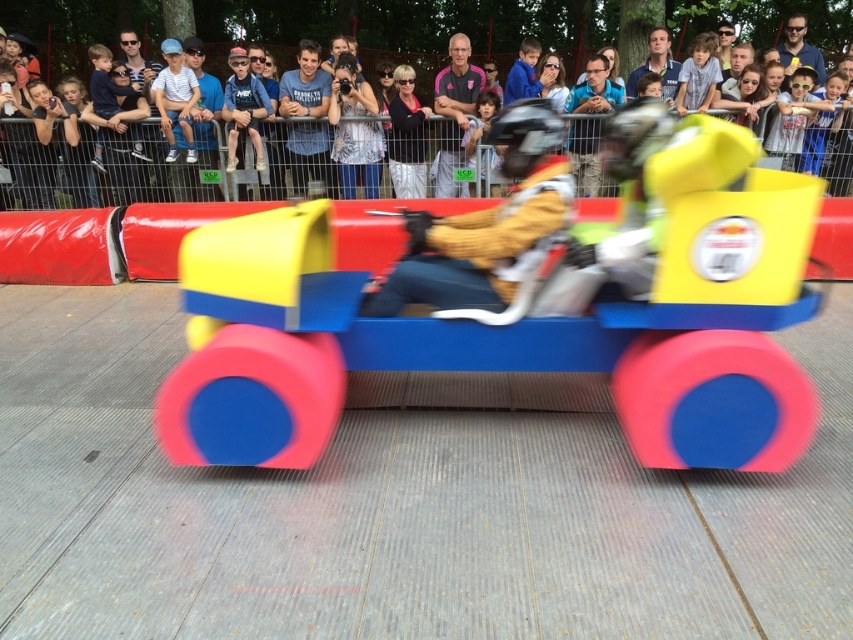
Question: Is matte plastic toy car at center closer to the viewer compared to denim jacket at upper center?

Choices:
 (A) yes
 (B) no

Answer: (A)

Question: Which object is farther from the camera taking this photo?

Choices:
 (A) matte plastic crowd at upper center
 (B) denim jacket at upper center
 (C) matte plastic toy car at center
 (D) yellow matte helmet at center

Answer: (A)

Question: Is matte plastic toy car at center bigger than matte plastic crowd at upper center?

Choices:
 (A) no
 (B) yes

Answer: (A)

Question: Which of the following is the farthest from the observer?

Choices:
 (A) (392, 44)
 (B) (714, 376)
 (C) (431, 266)
 (D) (259, 77)

Answer: (A)

Question: Can you confirm if yellow matte helmet at center is bigger than denim jacket at upper center?

Choices:
 (A) yes
 (B) no

Answer: (B)

Question: Among these objects, which one is farthest from the camera?

Choices:
 (A) denim jacket at upper center
 (B) yellow matte helmet at center
 (C) matte plastic toy car at center

Answer: (A)